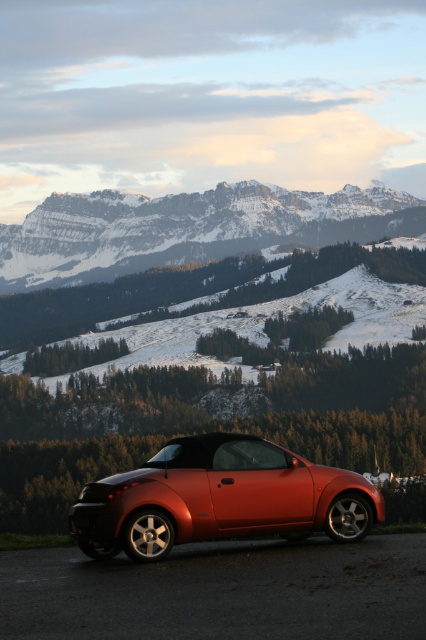
You are standing at the base of the snowy rocky mountain at upper center. If you walk straight towards the direction of the car, will you reach the car before reaching the mountain?

The snowy rocky mountain at upper center is positioned at point (187, 228). Since the car is parked on the road and the mountain is in the background, walking towards the car would mean moving away from the mountain. Therefore, you would reach the car before the mountain.

You are standing at the base of the snowy rocky mountain at upper center. If you look towards the point marked at coordinates (187, 228), which object in the scene would you be facing?

The snowy rocky mountain at upper center is represented by the point at coordinates (187, 228), so you would be facing the snowy rocky mountain at upper center.